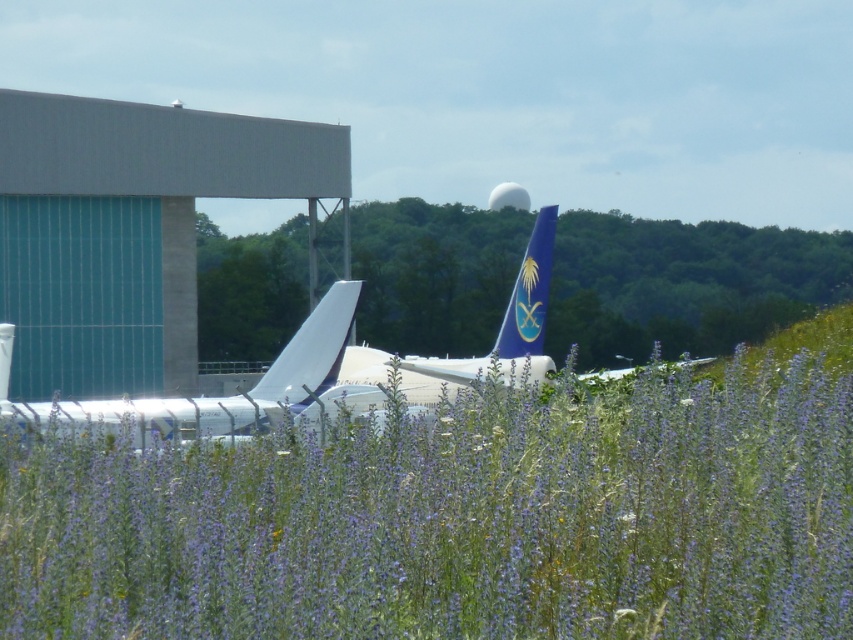
You are a drone operator trying to navigate a drone through the airport scene. The drone needs to fly from the hangar to the purple grass at center. Based on the spatial information provided, can the drone safely pass through the area between the two airplanes parked near the hangar?

The purple grass at center is located at point (457, 518), which suggests it is positioned towards the lower center of the image. Since the two airplanes are parked near the hangar on the left side, the drone should be able to navigate around them towards the purple grass without obstruction, provided there are no additional obstacles not mentioned in the scene description.

You are standing at the airport and want to locate two specific points marked in the scene. Which point, point 1 at coordinates (569, 401) or point 2 at coordinates (525, 262), is nearer to you?

Point 1 at coordinates (569, 401) is closer to the viewer than point 2 at coordinates (525, 262).